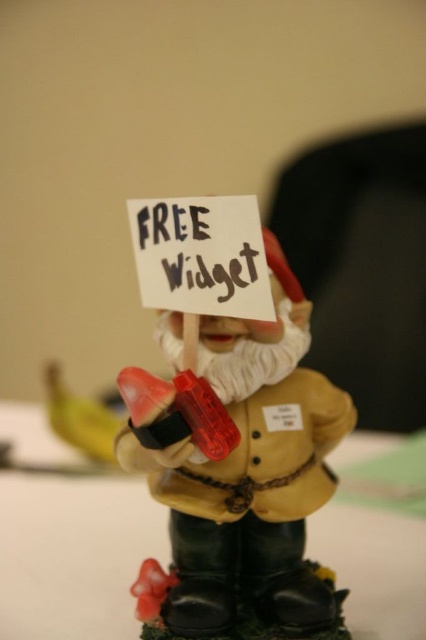
You are setting up a display in a store and need to place the matte yellow figurine at center on the green matte table at center. The table has a maximum load capacity of 2 kilograms. If the figurine weighs 1.5 kilograms, will it be safe to place it there?

The matte yellow figurine at center weighs 1.5 kilograms, which is under the table maximum load capacity of 2 kilograms. Therefore, it is safe to place it there.

You are setting up a small display and need to place both the green matte table at center and the yellow matte banana at lower left. Which object should you choose if you need an item with a larger width for your arrangement?

The green matte table at center has a larger width than the yellow matte banana at lower left, so you should choose the green matte table at center for the arrangement requiring a wider item.